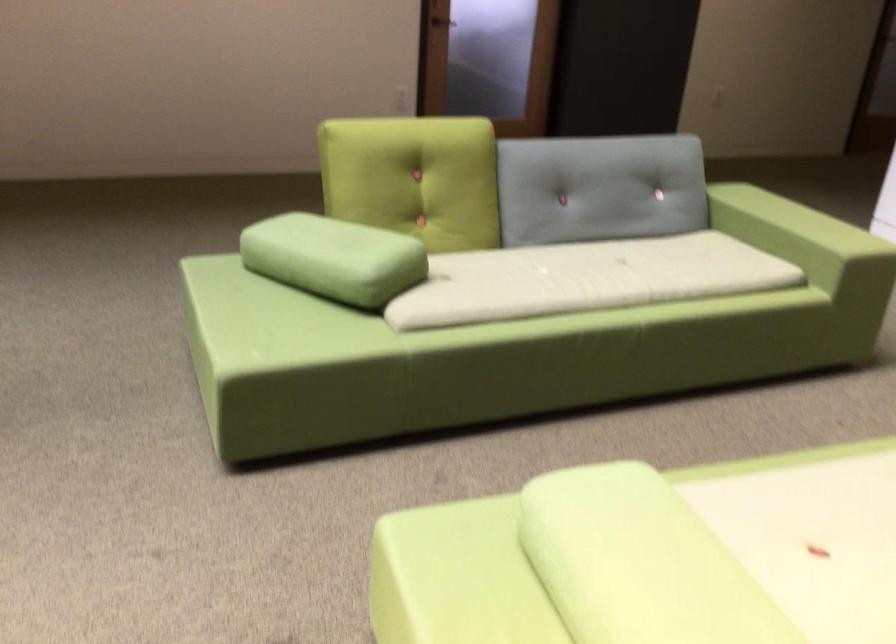
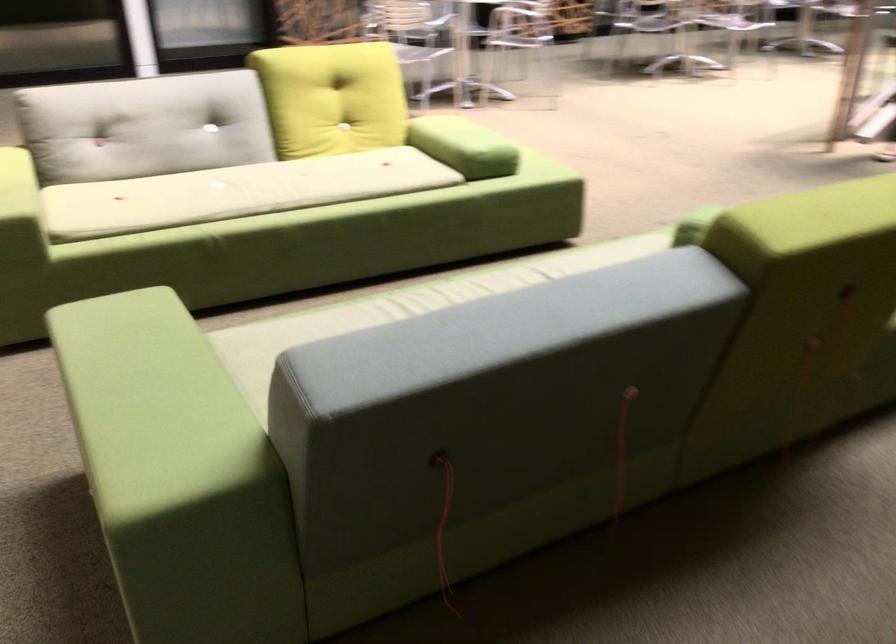
Where in the second image is the point corresponding to [642,469] from the first image?

(464, 146)